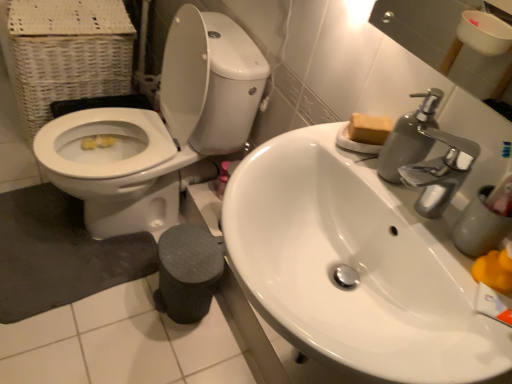
The height and width of the screenshot is (384, 512). In order to click on free space in front of metallic gray soap dispenser at upper right in this screenshot , I will do `click(411, 215)`.